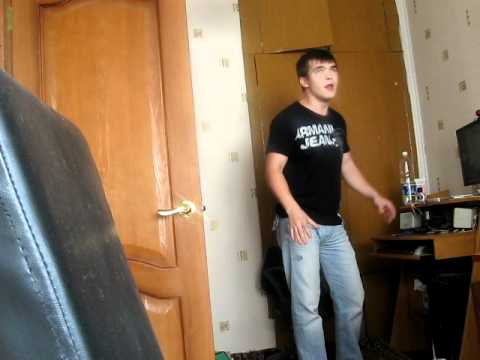
Identify the location of bottle. The image size is (480, 360). (398, 162).